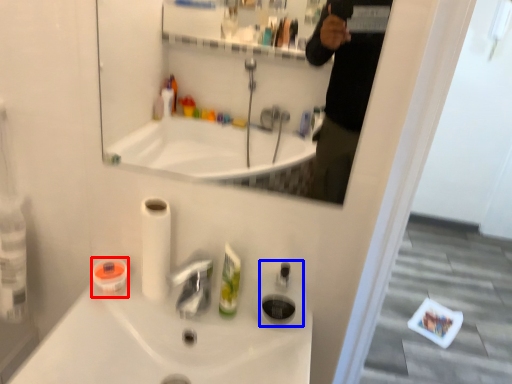
Question: Which object is further to the camera taking this photo, mouthwash (highlighted by a red box) or soap dispenser (highlighted by a blue box)?

Choices:
 (A) mouthwash
 (B) soap dispenser

Answer: (A)